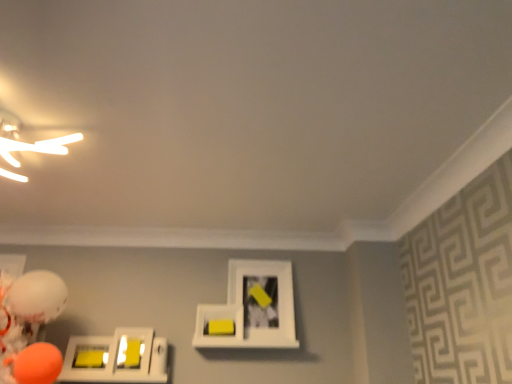
Describe the element at coordinates (251, 309) in the screenshot. I see `white matte picture frame at center` at that location.

Where is `white matte picture frame at center`? The width and height of the screenshot is (512, 384). white matte picture frame at center is located at coordinates (251, 309).

Locate an element on the screen. The height and width of the screenshot is (384, 512). white matte picture frame at center is located at coordinates (251, 309).